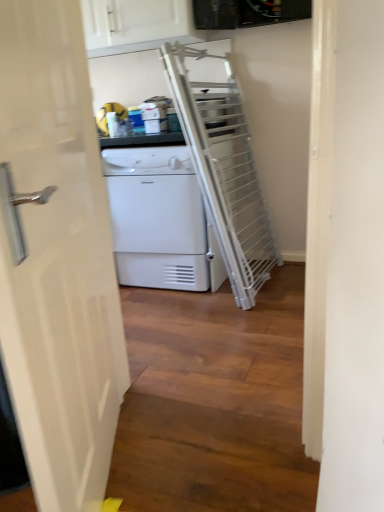
Question: Would you say white glossy door at left is outside white matte/texture dryer at center?

Choices:
 (A) no
 (B) yes

Answer: (B)

Question: Is white glossy door at left positioned with its back to white matte/texture dryer at center?

Choices:
 (A) yes
 (B) no

Answer: (B)

Question: Is white matte/texture dryer at center located within white glossy door at left?

Choices:
 (A) no
 (B) yes

Answer: (A)

Question: Does white glossy door at left have a greater height compared to white matte/texture dryer at center?

Choices:
 (A) yes
 (B) no

Answer: (A)

Question: Is white glossy door at left to the left of white matte/texture dryer at center from the viewer's perspective?

Choices:
 (A) no
 (B) yes

Answer: (B)

Question: From a real-world perspective, is white glossy cabinet at upper center positioned above or below white matte/texture dryer at center?

Choices:
 (A) below
 (B) above

Answer: (B)

Question: In terms of height, does white glossy cabinet at upper center look taller or shorter compared to white matte/texture dryer at center?

Choices:
 (A) tall
 (B) short

Answer: (B)

Question: In the image, is white glossy cabinet at upper center positioned in front of or behind white matte/texture dryer at center?

Choices:
 (A) behind
 (B) front

Answer: (A)

Question: Is white glossy cabinet at upper center bigger or smaller than white matte/texture dryer at center?

Choices:
 (A) big
 (B) small

Answer: (B)

Question: Looking at their shapes, would you say white matte/texture dryer at center is wider or thinner than white glossy door at left?

Choices:
 (A) thin
 (B) wide

Answer: (B)

Question: Looking at the image, does white matte/texture dryer at center seem bigger or smaller compared to white glossy door at left?

Choices:
 (A) small
 (B) big

Answer: (B)

Question: In terms of height, does white matte/texture dryer at center look taller or shorter compared to white glossy door at left?

Choices:
 (A) short
 (B) tall

Answer: (A)

Question: Would you say white matte/texture dryer at center is inside or outside white glossy door at left?

Choices:
 (A) outside
 (B) inside

Answer: (A)

Question: From the image's perspective, is white glossy door at left positioned above or below white matte/texture dryer at center?

Choices:
 (A) below
 (B) above

Answer: (A)

Question: Considering the positions of point (44, 169) and point (205, 219), is point (44, 169) closer or farther from the camera than point (205, 219)?

Choices:
 (A) closer
 (B) farther

Answer: (A)